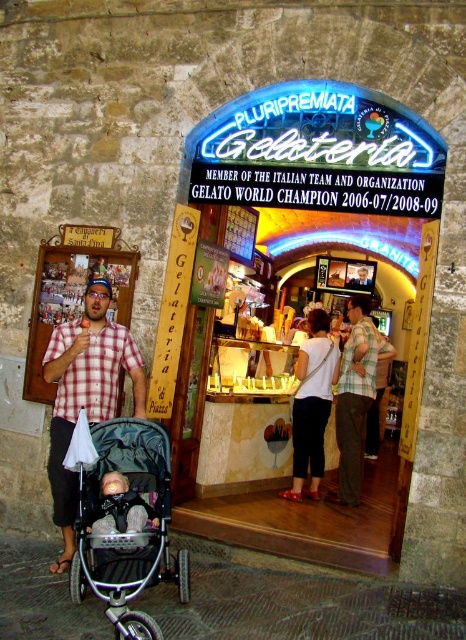
Between silver metallic stroller at lower left and matte white blouse at center, which one appears on the right side from the viewer's perspective?

From the viewer's perspective, matte white blouse at center appears more on the right side.

Describe the element at coordinates (123, 518) in the screenshot. I see `silver metallic stroller at lower left` at that location.

Is point (153, 440) behind point (328, 346)?

No, (153, 440) is in front of (328, 346).

Locate an element on the screen. The width and height of the screenshot is (466, 640). silver metallic stroller at lower left is located at coordinates (123, 518).

Who is more distant from viewer, (348,394) or (316,353)?

Positioned behind is point (348,394).

Consider the image. Can you confirm if plaid shirt at center is shorter than matte white blouse at center?

Incorrect, plaid shirt at center's height does not fall short of matte white blouse at center's.

What do you see at coordinates (355, 397) in the screenshot?
I see `plaid shirt at center` at bounding box center [355, 397].

You are a GUI agent. You are given a task and a screenshot of the screen. Output one action in this format:
    pyautogui.click(x=<x>, y=<y>)
    Task: Click on the plaid shirt at center
    The image size is (466, 640).
    Given the screenshot: What is the action you would take?
    pyautogui.click(x=355, y=397)

Which of these two, matte white blouse at center or soft beige fabric baby carriage at lower left, stands taller?

matte white blouse at center is taller.

Can you confirm if matte white blouse at center is smaller than soft beige fabric baby carriage at lower left?

No, matte white blouse at center is not smaller than soft beige fabric baby carriage at lower left.

At what (x,y) coordinates should I click in order to perform the action: click on matte white blouse at center. Please return your answer as a coordinate pair (x, y). Image resolution: width=466 pixels, height=640 pixels. Looking at the image, I should click on (312, 403).